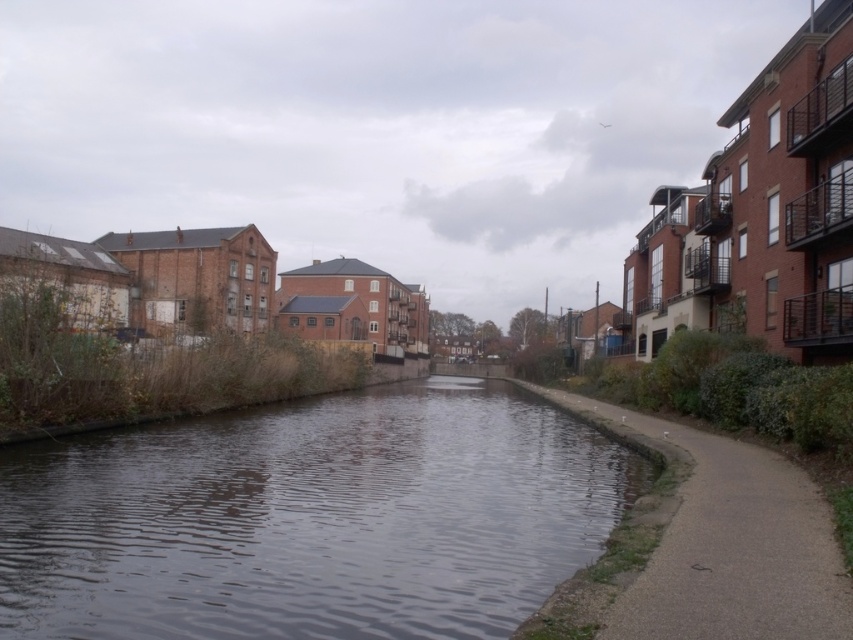
Is dark water at center above gray concrete pavement at lower right?

No.

How far apart are dark water at center and gray concrete pavement at lower right?

A distance of 6.49 meters exists between dark water at center and gray concrete pavement at lower right.

Does point (119, 435) come behind point (833, 627)?

Yes, it is.

Where is `dark water at center`? The width and height of the screenshot is (853, 640). dark water at center is located at coordinates (310, 518).